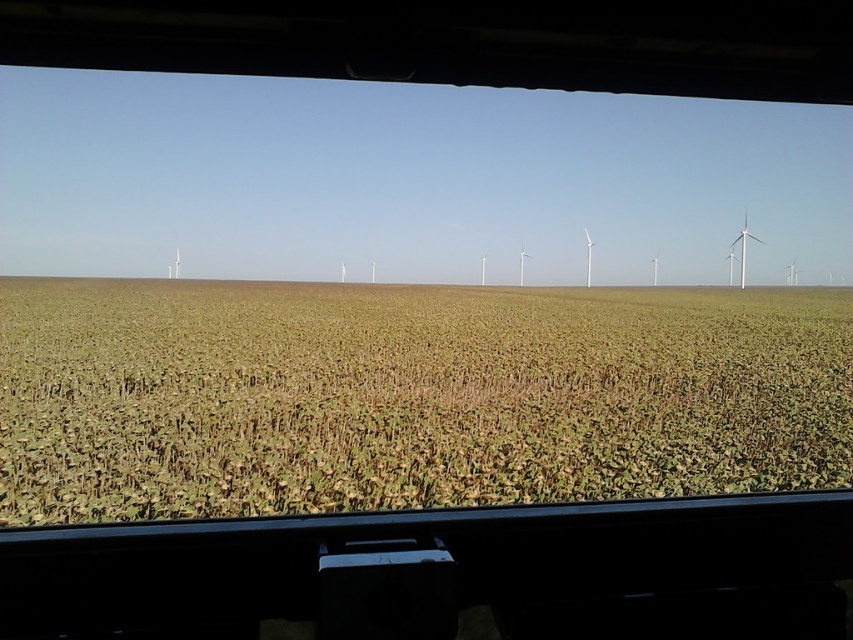
Question: Is green matte wheat field at center to the right of white matte wind turbine at right from the viewer's perspective?

Choices:
 (A) no
 (B) yes

Answer: (A)

Question: Can you confirm if green matte wheat field at center is smaller than white matte wind turbine at right?

Choices:
 (A) yes
 (B) no

Answer: (B)

Question: Which point appears farthest from the camera in this image?

Choices:
 (A) (741, 228)
 (B) (799, 385)

Answer: (A)

Question: Is green matte wheat field at center to the left of white matte wind turbine at right from the viewer's perspective?

Choices:
 (A) no
 (B) yes

Answer: (B)